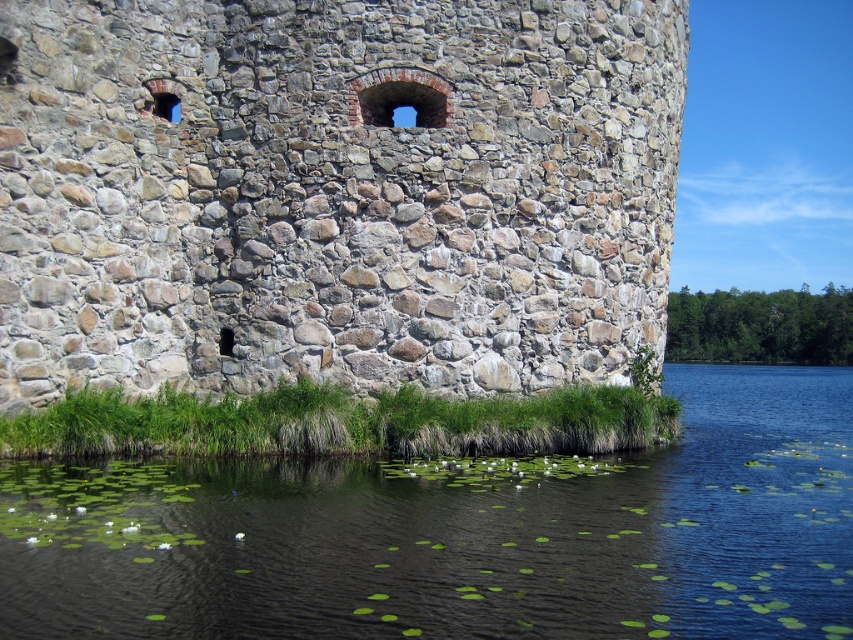
Question: Considering the real-world distances, which object is closest to the green leafy pond at lower left?

Choices:
 (A) natural stone wall at center
 (B) green grass at lower center

Answer: (B)

Question: Among these points, which one is nearest to the camera?

Choices:
 (A) (751, 602)
 (B) (265, 0)
 (C) (346, 442)

Answer: (A)

Question: Does natural stone wall at center appear under green grass at lower center?

Choices:
 (A) yes
 (B) no

Answer: (B)

Question: Which object is the farthest from the green leafy pond at lower left?

Choices:
 (A) natural stone wall at center
 (B) green grass at lower center

Answer: (A)

Question: Can you confirm if natural stone wall at center is wider than green leafy pond at lower left?

Choices:
 (A) no
 (B) yes

Answer: (A)

Question: Is green leafy pond at lower left above green grass at lower center?

Choices:
 (A) no
 (B) yes

Answer: (A)